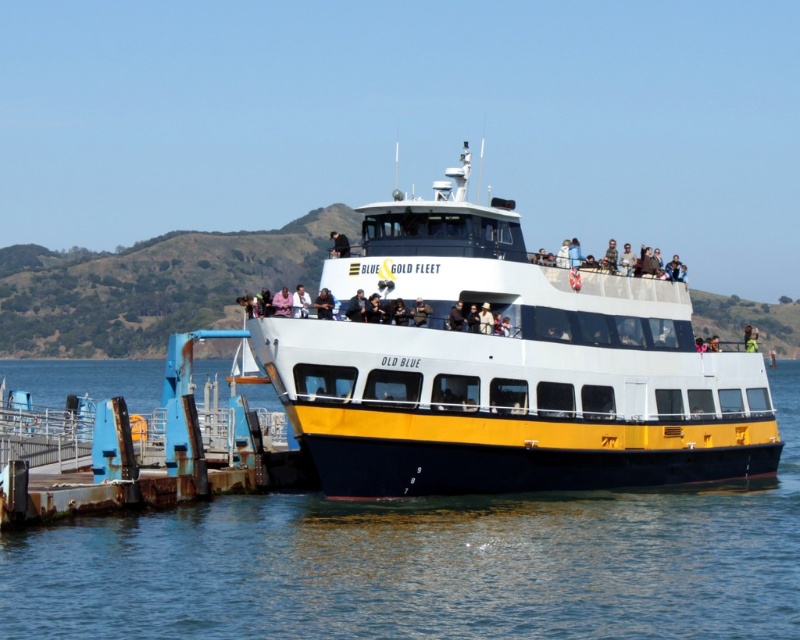
Is yellow matte ferry at center above matte black jacket at upper center?

Indeed, yellow matte ferry at center is positioned over matte black jacket at upper center.

Which of these two, yellow matte ferry at center or matte black jacket at upper center, stands taller?

yellow matte ferry at center

Who is more forward, (636, 397) or (342, 241)?

Positioned in front is point (342, 241).

Identify the location of yellow matte ferry at center. The image size is (800, 640). (505, 368).

Is blue water at lower left positioned behind rusty metal dock at lower left?

No.

Is blue water at lower left to the right of rusty metal dock at lower left from the viewer's perspective?

Correct, you'll find blue water at lower left to the right of rusty metal dock at lower left.

Is point (680, 557) closer to viewer compared to point (97, 381)?

Yes.

Locate an element on the screen. blue water at lower left is located at coordinates (428, 564).

Which of these two, yellow matte ferry at center or matte white people at upper center, stands taller?

yellow matte ferry at center

Is yellow matte ferry at center positioned before matte white people at upper center?

That is True.

At what (x,y) coordinates should I click in order to perform the action: click on yellow matte ferry at center. Please return your answer as a coordinate pair (x, y). Looking at the image, I should click on (505, 368).